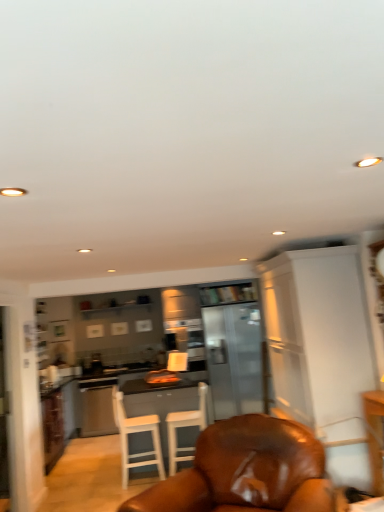
Locate an element on the screen. The image size is (384, 512). satin silver dishwasher at center is located at coordinates (97, 406).

Describe the element at coordinates (97, 406) in the screenshot. This screenshot has height=512, width=384. I see `satin silver dishwasher at center` at that location.

Locate an element on the screen. This screenshot has width=384, height=512. white glossy cabinet at right is located at coordinates (318, 337).

The width and height of the screenshot is (384, 512). What do you see at coordinates (228, 294) in the screenshot? I see `wooden bookshelf at center` at bounding box center [228, 294].

This screenshot has height=512, width=384. Identify the location of white wood chair at center, the second chair viewed from the front. (136, 432).

Can you confirm if wooden bookshelf at center is positioned to the right of white wood chair at center, placed as the first chair when sorted from back to front?

Indeed, wooden bookshelf at center is positioned on the right side of white wood chair at center, placed as the first chair when sorted from back to front.

Are wooden bookshelf at center and white wood chair at center, placed as the first chair when sorted from back to front, located far from each other?

That's right, there is a large distance between wooden bookshelf at center and white wood chair at center, placed as the first chair when sorted from back to front.

Which object is wider, wooden bookshelf at center or white wood chair at center, placed as the first chair when sorted from back to front?

white wood chair at center, placed as the first chair when sorted from back to front.

Is wooden bookshelf at center facing towards white wood chair at center, placed as the first chair when sorted from back to front?

No, wooden bookshelf at center is not facing towards white wood chair at center, placed as the first chair when sorted from back to front.

Is brown leather chair at center, which is counted as the third chair, starting from the back, oriented away from satin silver dishwasher at center?

No, brown leather chair at center, which is counted as the third chair, starting from the back, is not facing away from satin silver dishwasher at center.

Considering the relative sizes of brown leather chair at center, arranged as the first chair when viewed from the front, and satin silver dishwasher at center in the image provided, is brown leather chair at center, arranged as the first chair when viewed from the front, thinner than satin silver dishwasher at center?

In fact, brown leather chair at center, arranged as the first chair when viewed from the front, might be wider than satin silver dishwasher at center.

Where is `dish washer located below the brown leather chair at center, which is counted as the third chair, starting from the back (from the image's perspective)`? This screenshot has width=384, height=512. dish washer located below the brown leather chair at center, which is counted as the third chair, starting from the back (from the image's perspective) is located at coordinates (97, 406).

Is brown leather chair at center, arranged as the first chair when viewed from the front, outside of satin silver dishwasher at center?

That's correct, brown leather chair at center, arranged as the first chair when viewed from the front, is outside of satin silver dishwasher at center.

Does white wood table at center have a greater width compared to white wood chair at center, the third chair positioned from the front?

Yes, white wood table at center is wider than white wood chair at center, the third chair positioned from the front.

Is white wood table at center oriented away from white wood chair at center, the third chair positioned from the front?

No, white wood table at center's orientation is not away from white wood chair at center, the third chair positioned from the front.

Considering the sizes of wooden bookshelf at center and white wood chair at center, acting as the second chair starting from the back, in the image, is wooden bookshelf at center taller or shorter than white wood chair at center, acting as the second chair starting from the back,?

In the image, wooden bookshelf at center appears to be shorter than white wood chair at center, acting as the second chair starting from the back.

Would you say wooden bookshelf at center is outside white wood chair at center, the second chair viewed from the front?

Yes, wooden bookshelf at center is located beyond the bounds of white wood chair at center, the second chair viewed from the front.

Between wooden bookshelf at center and white wood chair at center, the second chair viewed from the front, which one has smaller width?

wooden bookshelf at center.

Is white wood chair at center, acting as the second chair starting from the back, not within brown leather chair at center, arranged as the first chair when viewed from the front?

Indeed, white wood chair at center, acting as the second chair starting from the back, is completely outside brown leather chair at center, arranged as the first chair when viewed from the front.

Is white wood chair at center, the second chair viewed from the front, wider than brown leather chair at center, which is counted as the third chair, starting from the back?

Incorrect, the width of white wood chair at center, the second chair viewed from the front, does not surpass that of brown leather chair at center, which is counted as the third chair, starting from the back.

Is white wood chair at center, acting as the second chair starting from the back, far from brown leather chair at center, arranged as the first chair when viewed from the front?

white wood chair at center, acting as the second chair starting from the back, is positioned a significant distance from brown leather chair at center, arranged as the first chair when viewed from the front.

Between point (120, 422) and point (264, 453), which one is positioned in front?

Point (264, 453)

Would you say white glossy cabinet at right is to the left or to the right of white wood chair at center, the third chair positioned from the front, in the picture?

white glossy cabinet at right is positioned on white wood chair at center, the third chair positioned from the front,'s right side.

From a real-world perspective, which is physically below, white glossy cabinet at right or white wood chair at center, the third chair positioned from the front?

white wood chair at center, the third chair positioned from the front, from a real-world perspective.

Which object is wider, white glossy cabinet at right or white wood chair at center, placed as the first chair when sorted from back to front?

Wider between the two is white glossy cabinet at right.

From the image's perspective, which one is positioned lower, white glossy cabinet at right or white wood chair at center, the third chair positioned from the front?

From the image's view, white wood chair at center, the third chair positioned from the front, is below.

Looking at this image, what's the angular difference between wooden bookshelf at center and white glossy cabinet at right's facing directions?

The angle between the facing direction of wooden bookshelf at center and the facing direction of white glossy cabinet at right is 88.8 degrees.

Which of these two, wooden bookshelf at center or white glossy cabinet at right, is thinner?

With smaller width is wooden bookshelf at center.

Which is in front, wooden bookshelf at center or white glossy cabinet at right?

Positioned in front is white glossy cabinet at right.

Where is `shelf above the white wood chair at center, placed as the first chair when sorted from back to front (from the image's perspective)`? shelf above the white wood chair at center, placed as the first chair when sorted from back to front (from the image's perspective) is located at coordinates (228, 294).

This screenshot has height=512, width=384. What are the coordinates of `the 3rd chair in front of the satin silver dishwasher at center` in the screenshot? It's located at (246, 471).

When comparing their distances from wooden bookshelf at center, does white wood chair at center, acting as the second chair starting from the back, or brown leather chair at center, which is counted as the third chair, starting from the back, seem further?

Among the two, brown leather chair at center, which is counted as the third chair, starting from the back, is located further to wooden bookshelf at center.

In the scene shown: Considering their positions, is brown leather chair at center, arranged as the first chair when viewed from the front, positioned further to white wood chair at center, the second chair viewed from the front, than white wood table at center?

brown leather chair at center, arranged as the first chair when viewed from the front.

From the picture: Looking at the image, which one is located closer to brown leather chair at center, which is counted as the third chair, starting from the back, wooden bookshelf at center or white wood chair at center, acting as the second chair starting from the back?

The object closer to brown leather chair at center, which is counted as the third chair, starting from the back, is white wood chair at center, acting as the second chair starting from the back.

When comparing their distances from wooden bookshelf at center, does brown leather chair at center, arranged as the first chair when viewed from the front, or satin silver dishwasher at center seem closer?

Based on the image, satin silver dishwasher at center appears to be nearer to wooden bookshelf at center.

From the image, which object appears to be farther from wooden bookshelf at center, white wood chair at center, placed as the first chair when sorted from back to front, or satin silver dishwasher at center?

satin silver dishwasher at center is further to wooden bookshelf at center.

Considering their positions, is white wood table at center positioned further to brown leather chair at center, which is counted as the third chair, starting from the back, than white glossy cabinet at right?

white wood table at center is positioned further to the anchor brown leather chair at center, which is counted as the third chair, starting from the back.

Estimate the real-world distances between objects in this image. Which object is closer to wooden bookshelf at center, satin silver dishwasher at center or white wood table at center?

white wood table at center is closer to wooden bookshelf at center.

Based on their spatial positions, is white wood chair at center, the third chair positioned from the front, or wooden bookshelf at center further from white glossy cabinet at right?

The object further to white glossy cabinet at right is white wood chair at center, the third chair positioned from the front.

This screenshot has height=512, width=384. What are the coordinates of `dish washer between white glossy cabinet at right and wooden bookshelf at center along the z-axis` in the screenshot? It's located at (97, 406).

Where is `dish washer between white wood table at center and wooden bookshelf at center along the z-axis`? The width and height of the screenshot is (384, 512). dish washer between white wood table at center and wooden bookshelf at center along the z-axis is located at coordinates (97, 406).

I want to click on dish washer between white wood chair at center, placed as the first chair when sorted from back to front, and wooden bookshelf at center in the front-back direction, so click(x=97, y=406).

You are a GUI agent. You are given a task and a screenshot of the screen. Output one action in this format:
    pyautogui.click(x=<x>, y=<y>)
    Task: Click on the table between brown leather chair at center, arranged as the first chair when viewed from the front, and satin silver dishwasher at center in the front-back direction
    This screenshot has height=512, width=384.
    Given the screenshot: What is the action you would take?
    pyautogui.click(x=162, y=404)